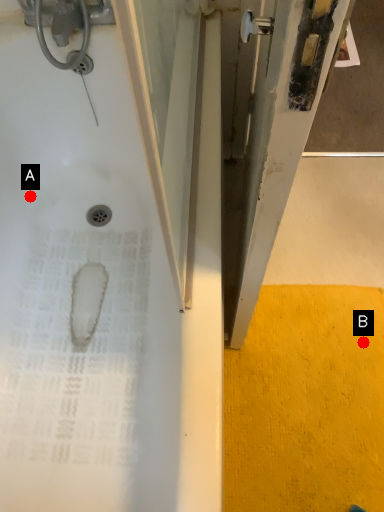
Question: Two points are circled on the image, labeled by A and B beside each circle. Which point is closer to the camera?

Choices:
 (A) A is closer
 (B) B is closer

Answer: (B)